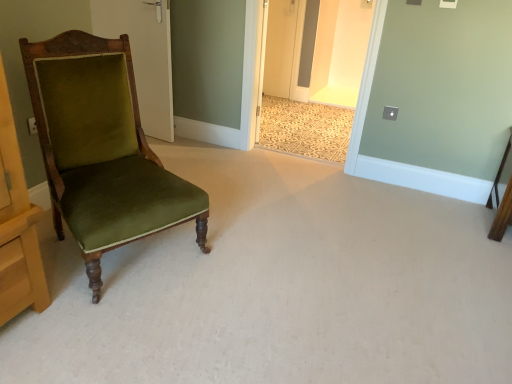
Identify the location of vacant area that is situated to the right of velvet green chair at left. The height and width of the screenshot is (384, 512). (248, 253).